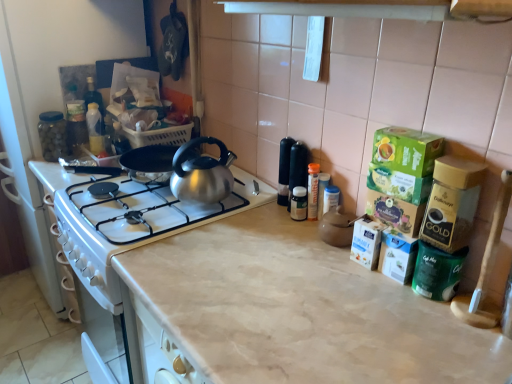
Question: Would you say transparent glass jar at left, positioned as the 2th appliance in bottom-to-top order, is to the left or to the right of beige marble countertop at center in the picture?

Choices:
 (A) left
 (B) right

Answer: (A)

Question: Is transparent glass jar at left, the 1th appliance when ordered from back to front, spatially inside beige marble countertop at center, or outside of it?

Choices:
 (A) inside
 (B) outside

Answer: (B)

Question: Which of these objects is positioned closest to the transparent glass jar at left, placed as the first appliance when sorted from left to right?

Choices:
 (A) beige marble countertop at center
 (B) green matte coffee container at right, positioned as the 1th appliance in bottom-to-top order

Answer: (A)

Question: Which of these objects is positioned closest to the beige marble countertop at center?

Choices:
 (A) green matte coffee container at right, which is the first appliance in right-to-left order
 (B) transparent glass jar at left, positioned as the 2th appliance in bottom-to-top order

Answer: (A)